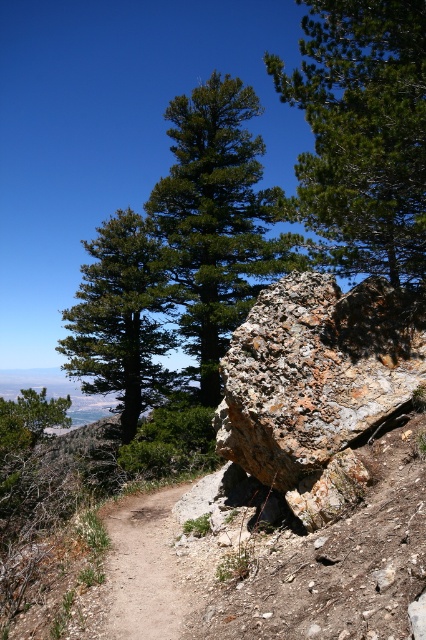
You are a hiker trying to navigate through the valley. You see two green matte trees in the distance. Which tree is higher up in the image, the green matte tree at upper center or the green matte tree at upper left?

The green matte tree at upper center is located above the green matte tree at upper left, so it is higher up in the image.

You are a hiker standing at the edge of the valley looking at the scene. You see the green leafy tree at center and the brown dirt track at center. Which object is closer to you?

The green leafy tree at center is closer to you because the brown dirt track at center is behind it.

You are a hiker trying to navigate to a specific point marked on your map. The coordinates given are point (362, 134). Based on the image, where is this point located?

The point (362, 134) is located on the green matte tree at upper center.